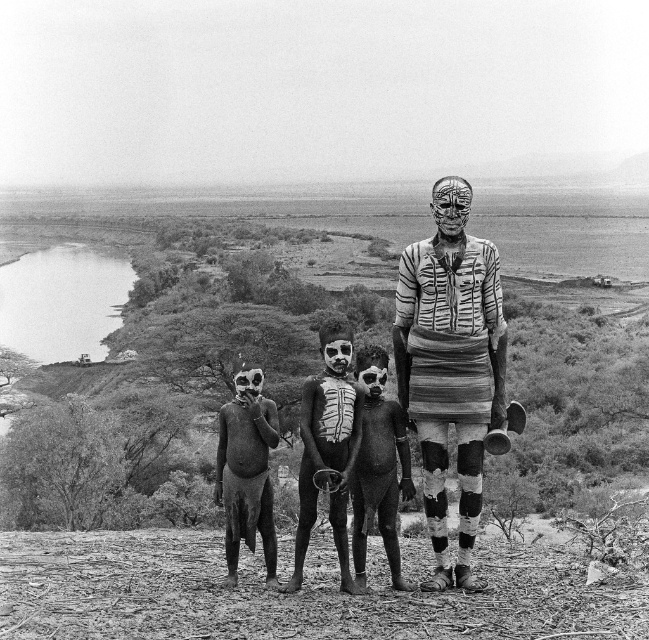
Based on the scene description, which object is taller, the painted wood figure at center or the matte mud man at lower left?

The painted wood figure at center is much taller than the matte mud man at lower left.

In the scene, you see a black textured body paint at center and a smooth skin child at center. Which one is covering part of the other?

The black textured body paint at center is positioned over the smooth skin child at center, so it is covering part of them.